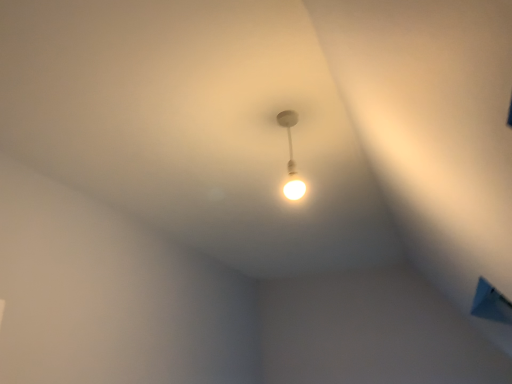
The image size is (512, 384). Describe the element at coordinates (291, 158) in the screenshot. I see `matte white lamp at center` at that location.

I want to click on matte white lamp at center, so click(291, 158).

In order to click on matte white lamp at center in this screenshot , I will do `click(291, 158)`.